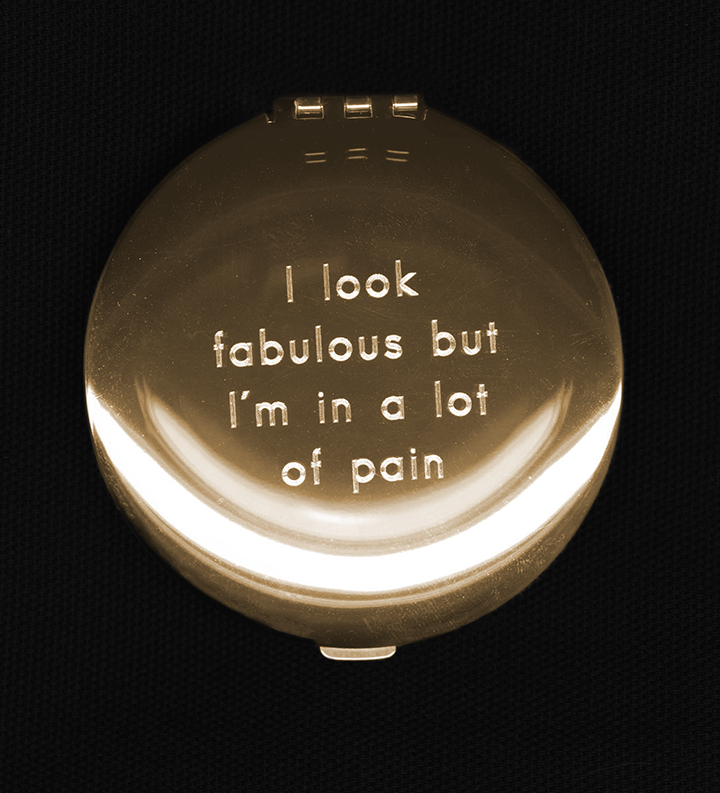
Where is `compact container`? compact container is located at coordinates (513, 288), (476, 603), (240, 595), (168, 407).